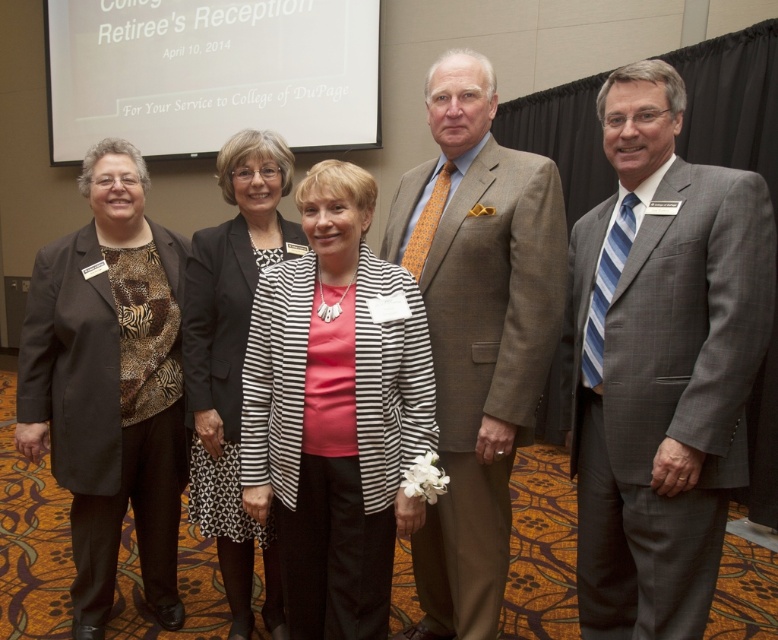
Question: Observing the image, what is the correct spatial positioning of striped fabric jacket at center in reference to black and white striped dress at center?

Choices:
 (A) left
 (B) right

Answer: (B)

Question: Is striped fabric jacket at center to the left of black and white striped dress at center from the viewer's perspective?

Choices:
 (A) no
 (B) yes

Answer: (A)

Question: Can you confirm if brown textured suit at center is bigger than matte black blazer at left?

Choices:
 (A) yes
 (B) no

Answer: (A)

Question: Which object is farther from the camera taking this photo?

Choices:
 (A) matte black blazer at left
 (B) brown textured suit at center
 (C) striped fabric jacket at center

Answer: (A)

Question: Which point is farther to the camera?

Choices:
 (A) matte black blazer at left
 (B) striped fabric jacket at center
 (C) brown textured suit at center
 (D) black and white striped dress at center

Answer: (D)

Question: Which point appears closest to the camera in this image?

Choices:
 (A) (598, 252)
 (B) (380, 458)
 (C) (279, 141)

Answer: (B)